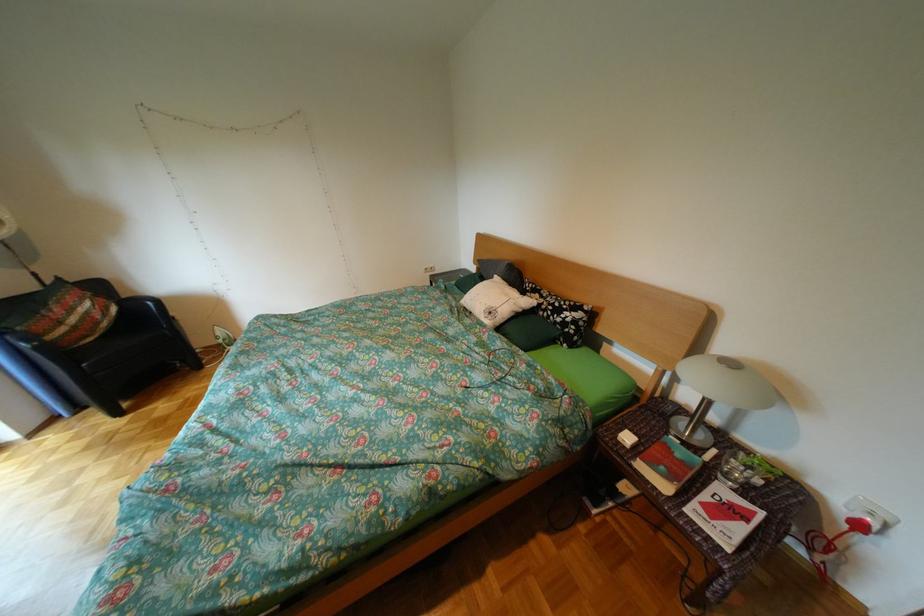
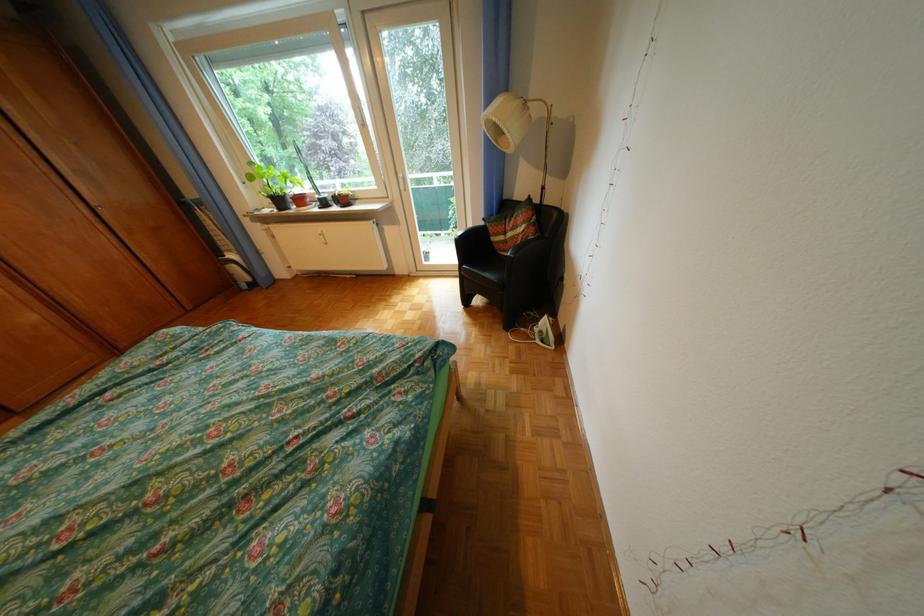
Find the pixel in the second image that matches pixel 88 321 in the first image.

(524, 236)